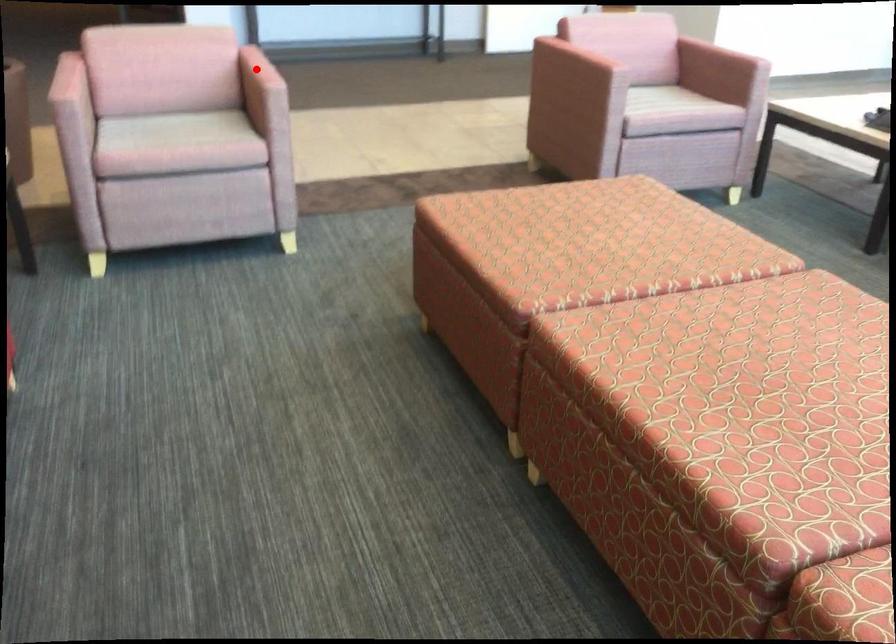
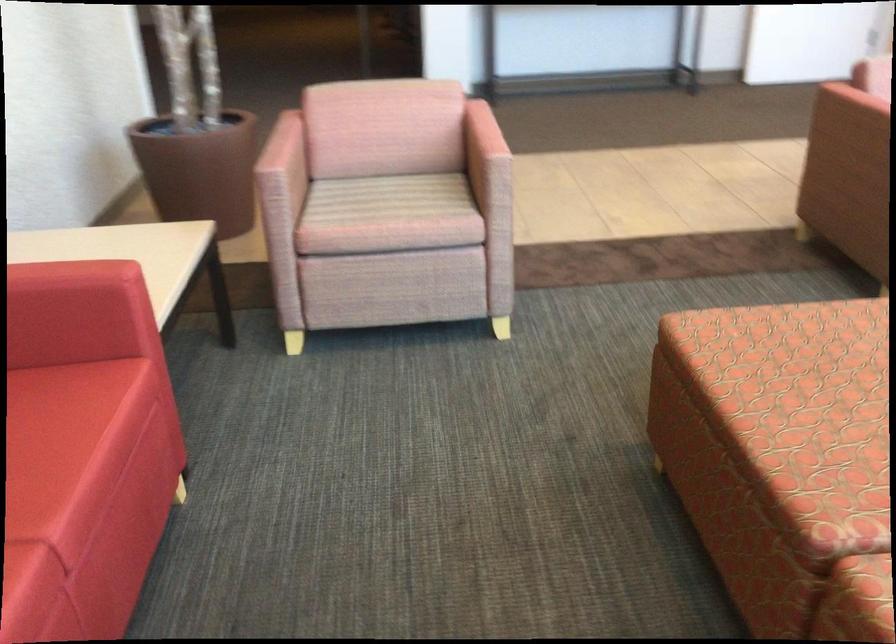
Find the pixel in the second image that matches the highlighted location in the first image.

(481, 133)